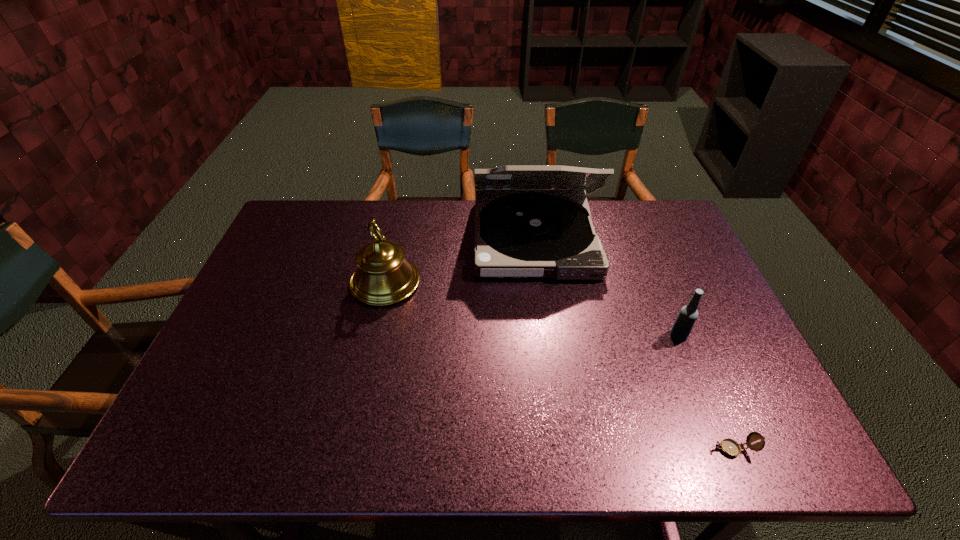
This screenshot has height=540, width=960. I want to click on vacant space located 0.120m on the back of the third farthest object, so click(662, 296).

The width and height of the screenshot is (960, 540). Find the location of `vacant space located 0.310m on the face of the compass`. vacant space located 0.310m on the face of the compass is located at coordinates (564, 449).

Find the location of a particular element. The height and width of the screenshot is (540, 960). free region located 0.370m on the face of the compass is located at coordinates (535, 449).

In order to click on free spot located 0.390m on the face of the compass in this screenshot , I will do `click(525, 449)`.

Locate an element on the screen. object present at the far edge is located at coordinates (526, 231).

Locate an element on the screen. The width and height of the screenshot is (960, 540). object located at the near edge is located at coordinates (728, 446).

Find the location of `bottle located in the right edge section of the desktop`. bottle located in the right edge section of the desktop is located at coordinates (687, 316).

Where is `compass positioned at the right edge`? compass positioned at the right edge is located at coordinates (728, 446).

Identify the location of object situated at the near right corner. (728, 446).

Find the location of a particular element. vacant space at the far edge of the desktop is located at coordinates (594, 218).